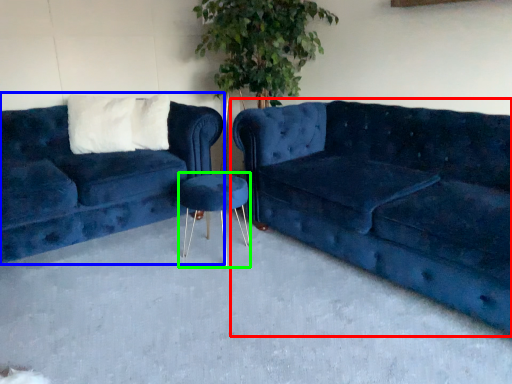
Question: Considering the real-world distances, which object is closest to studio couch (highlighted by a red box)? studio couch (highlighted by a blue box) or bar stool (highlighted by a green box).

Choices:
 (A) studio couch
 (B) bar stool

Answer: (B)